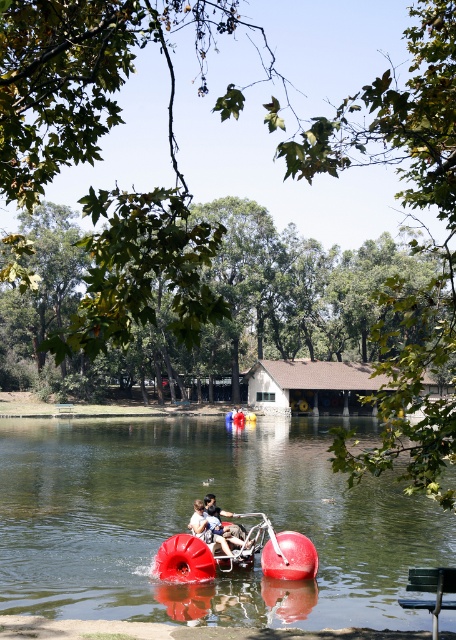
You are a visitor at the park and want to sit on the green plastic bench at lower right. From where you are standing, which side of the rubberized red float at center should you walk around to reach the bench?

You should walk around the right side of the rubberized red float at center to reach the green plastic bench at lower right since the bench is located to the right of the float.

You are a photographer planning to capture a photo of the red rubber water at center and the rubberized red float at center. You want to ensure both are visible in the frame. Based on their positions, which object should you place on the left side of your camera frame to include both?

The red rubber water at center should be placed on the left side of your camera frame because it is already positioned on the left side of the rubberized red float at center, allowing both objects to be captured together.